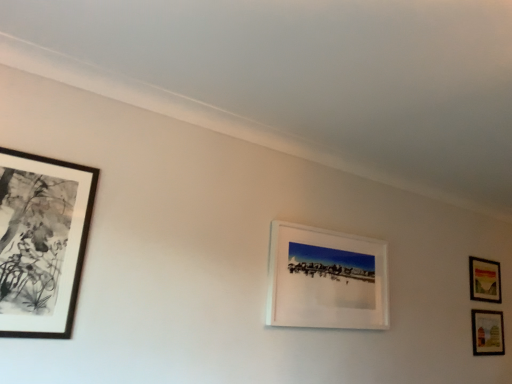
Question: Does matte wooden picture frame at lower right, which is the 4th picture frame from left to right, lie in front of black matte picture frame at left, which is the fourth picture frame in right-to-left order?

Choices:
 (A) yes
 (B) no

Answer: (B)

Question: Is matte wooden picture frame at lower right, the fourth picture frame in the front-to-back sequence, wider than black matte picture frame at left, which ranks as the fourth picture frame in back-to-front order?

Choices:
 (A) no
 (B) yes

Answer: (A)

Question: From the image's perspective, is matte wooden picture frame at lower right, the fourth picture frame in the front-to-back sequence, under black matte picture frame at left, placed as the first picture frame when sorted from front to back?

Choices:
 (A) no
 (B) yes

Answer: (B)

Question: From a real-world perspective, is matte wooden picture frame at lower right, which is counted as the 1th picture frame, starting from the right, positioned under black matte picture frame at left, the first picture frame viewed from the left, based on gravity?

Choices:
 (A) no
 (B) yes

Answer: (A)

Question: Is matte wooden picture frame at lower right, which is the 4th picture frame from left to right, smaller than black matte picture frame at left, the first picture frame viewed from the left?

Choices:
 (A) yes
 (B) no

Answer: (A)

Question: Considering their positions, is white matte picture frame at center, which is counted as the second picture frame, starting from the front, located in front of or behind matte wooden picture frame at lower right, arranged as the first picture frame when viewed from the back?

Choices:
 (A) front
 (B) behind

Answer: (A)

Question: In terms of size, does white matte picture frame at center, which is the third picture frame in back-to-front order, appear bigger or smaller than matte wooden picture frame at lower right, which is counted as the 1th picture frame, starting from the right?

Choices:
 (A) small
 (B) big

Answer: (B)

Question: Would you say white matte picture frame at center, which is counted as the second picture frame, starting from the front, is inside or outside matte wooden picture frame at lower right, which is the 4th picture frame from left to right?

Choices:
 (A) outside
 (B) inside

Answer: (A)

Question: Considering the positions of white matte picture frame at center, the 3th picture frame in the right-to-left sequence, and matte wooden picture frame at lower right, which is the 4th picture frame from left to right, in the image, is white matte picture frame at center, the 3th picture frame in the right-to-left sequence, taller or shorter than matte wooden picture frame at lower right, which is the 4th picture frame from left to right,?

Choices:
 (A) tall
 (B) short

Answer: (A)

Question: Would you say white matte picture frame at center, the 3th picture frame in the right-to-left sequence, is to the left or to the right of black matte picture frame at left, which ranks as the fourth picture frame in back-to-front order, in the picture?

Choices:
 (A) left
 (B) right

Answer: (B)

Question: Is white matte picture frame at center, which is the 2th picture frame from left to right, spatially inside black matte picture frame at left, the first picture frame viewed from the left, or outside of it?

Choices:
 (A) inside
 (B) outside

Answer: (B)

Question: Considering the positions of white matte picture frame at center, the 3th picture frame in the right-to-left sequence, and black matte picture frame at left, which is the fourth picture frame in right-to-left order, in the image, is white matte picture frame at center, the 3th picture frame in the right-to-left sequence, wider or thinner than black matte picture frame at left, which is the fourth picture frame in right-to-left order,?

Choices:
 (A) thin
 (B) wide

Answer: (A)

Question: Is point (382, 296) closer or farther from the camera than point (59, 238)?

Choices:
 (A) farther
 (B) closer

Answer: (A)

Question: Choose the correct answer: Is matte wooden picture frame at lower right, arranged as the first picture frame when viewed from the back, inside black matte picture frame at left, the first picture frame viewed from the left, or outside it?

Choices:
 (A) outside
 (B) inside

Answer: (A)

Question: Considering the positions of matte wooden picture frame at lower right, which is the 4th picture frame from left to right, and black matte picture frame at left, which ranks as the fourth picture frame in back-to-front order, in the image, is matte wooden picture frame at lower right, which is the 4th picture frame from left to right, wider or thinner than black matte picture frame at left, which ranks as the fourth picture frame in back-to-front order,?

Choices:
 (A) thin
 (B) wide

Answer: (A)